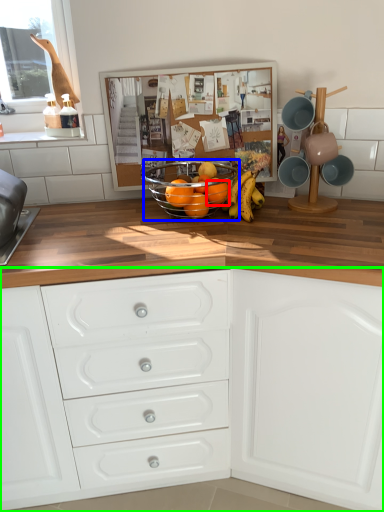
Question: Which object is the farthest from orange (highlighted by a red box)? Choose among these: glass bowl (highlighted by a blue box) or chest of drawers (highlighted by a green box).

Choices:
 (A) glass bowl
 (B) chest of drawers

Answer: (B)